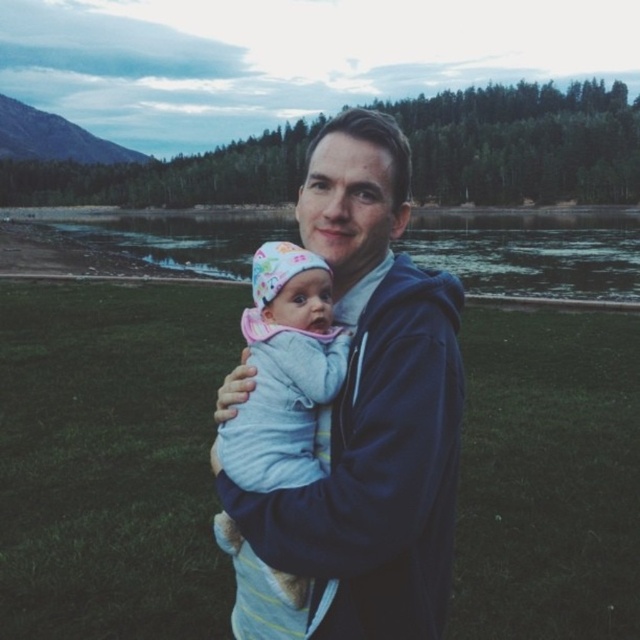
You are a fashion designer observing the scene. You need to determine which clothing item is taller between the dark blue hoodie at center and the light blue knit sweater at center. Which one is taller?

The dark blue hoodie at center is taller than the light blue knit sweater at center.

You are a fashion designer observing the scene. You need to determine which clothing item, the dark blue hoodie at center or the light blue knit sweater at center, would require more fabric to produce based on their sizes. Which one would need more fabric?

The dark blue hoodie at center has a larger size compared to the light blue knit sweater at center, so it would require more fabric to produce.

You are standing at the point labeled as point (596, 253) in the image. Can you see the man holding the baby from this position?

The point (596, 253) is 67.93 meters away from the viewer, so no, you cannot see the man holding the baby from this position since it is too far away.